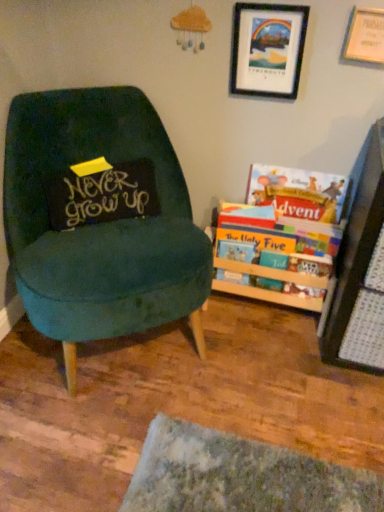
Question: From the image's perspective, relative to teal velvet chair at left, is black matte picture frame at upper right, placed as the 1th picture frame when sorted from left to right, above or below?

Choices:
 (A) below
 (B) above

Answer: (B)

Question: Considering the positions of black matte picture frame at upper right, the 2th picture frame viewed from the right, and teal velvet chair at left in the image, is black matte picture frame at upper right, the 2th picture frame viewed from the right, bigger or smaller than teal velvet chair at left?

Choices:
 (A) small
 (B) big

Answer: (A)

Question: Which object is positioned farthest from the hardcover book at right, the third book from the top?

Choices:
 (A) teal velvet chair at left
 (B) black matte picture frame at upper right, placed as the 1th picture frame when sorted from left to right
 (C) hardcover book at right, which ranks as the 3th book in bottom-to-top order
 (D) hardcover book at right, which is the 2th book in bottom-to-top order
 (E) black fabric pillow at left

Answer: (B)

Question: Estimate the real-world distances between objects in this image. Which object is farther from the hardcover book at right, the 1th book in the bottom-to-top sequence?

Choices:
 (A) black matte picture frame at upper right, the 2th picture frame viewed from the right
 (B) hardcover book at right, which is the 2th book in bottom-to-top order
 (C) teal velvet chair at left
 (D) hardcover book at right, acting as the 1th book starting from the top
 (E) black fabric pillow at left

Answer: (A)